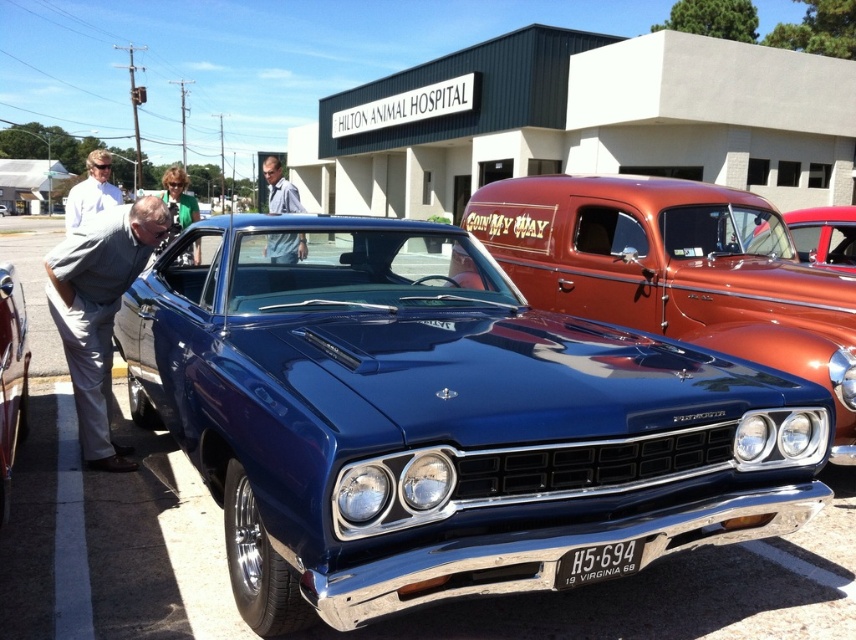
Question: Among these points, which one is farthest from the camera?

Choices:
 (A) (241, 518)
 (B) (749, 268)

Answer: (B)

Question: Does metallic blue car at center come in front of shiny red car at right?

Choices:
 (A) yes
 (B) no

Answer: (A)

Question: Does shiny blue car at center have a smaller size compared to metallic orange van at center?

Choices:
 (A) yes
 (B) no

Answer: (A)

Question: Which of the following is the farthest from the observer?

Choices:
 (A) green fabric jacket at center
 (B) gray fabric pants at lower left
 (C) metallic blue car at center

Answer: (A)

Question: Which of the following is the closest to the observer?

Choices:
 (A) (94, 166)
 (B) (837, 256)
 (C) (266, 180)

Answer: (A)

Question: Can you confirm if metallic orange van at center is wider than gray shirt at center?

Choices:
 (A) yes
 (B) no

Answer: (B)